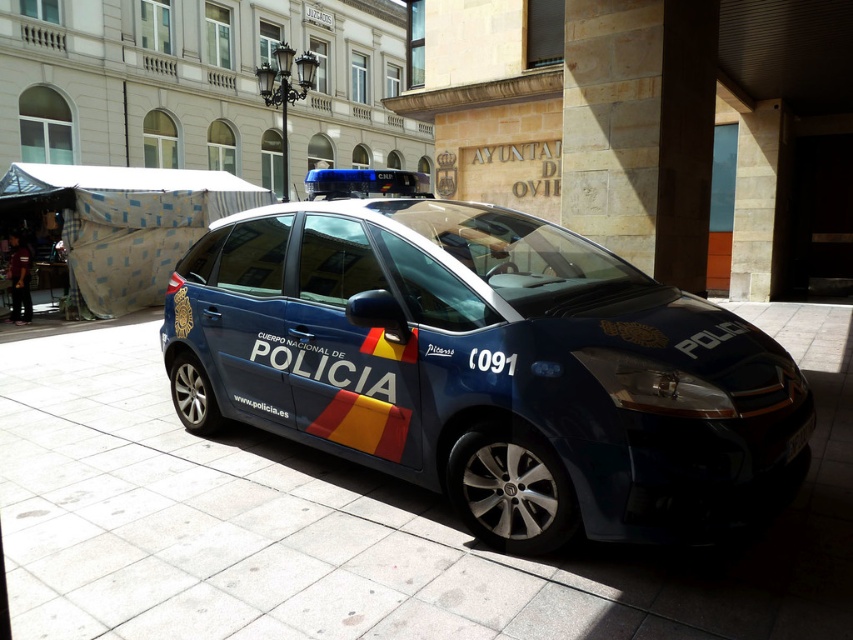
Question: Which point appears closest to the camera in this image?

Choices:
 (A) (804, 424)
 (B) (328, 493)

Answer: (A)

Question: Which object appears closest to the camera in this image?

Choices:
 (A) glossy blue police car at center
 (B) black plastic license plate at lower right

Answer: (A)

Question: Is slate gray pavement at center to the right of black plastic license plate at lower right from the viewer's perspective?

Choices:
 (A) no
 (B) yes

Answer: (A)

Question: Among these points, which one is farthest from the camera?

Choices:
 (A) (657, 365)
 (B) (788, 452)
 (C) (36, 628)

Answer: (B)

Question: Where is glossy blue police car at center located in relation to black plastic license plate at lower right in the image?

Choices:
 (A) left
 (B) right

Answer: (A)

Question: Can you confirm if glossy blue police car at center is wider than black plastic license plate at lower right?

Choices:
 (A) no
 (B) yes

Answer: (B)